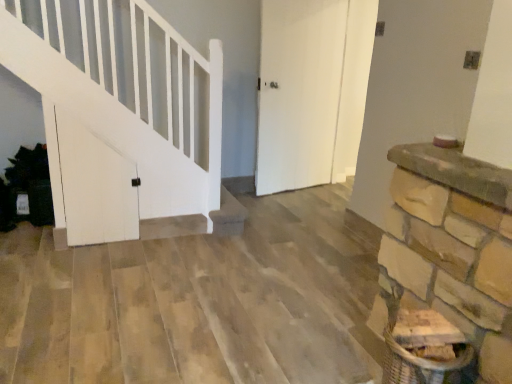
Find the location of a particular element. free space above white matte door at left, the 2th door from the right (from a real-world perspective) is located at coordinates (88, 97).